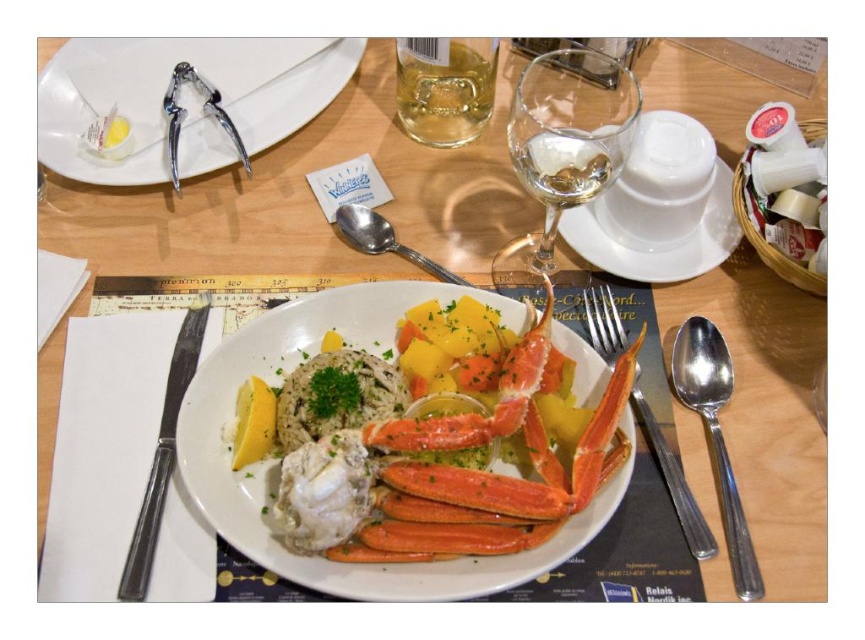
Question: Can you confirm if white glossy plate at center is smaller than metallic silver nutcracker at upper left?

Choices:
 (A) yes
 (B) no

Answer: (B)

Question: Which object is positioned farthest from the polished silver spoon at right?

Choices:
 (A) transparent glass wine glass at upper center
 (B) clear glass wine at upper center
 (C) translucent glass at upper center

Answer: (C)

Question: Observing the image, what is the correct spatial positioning of translucent glass at upper center in reference to satin silver fork at center right?

Choices:
 (A) left
 (B) right

Answer: (A)

Question: Which object is the farthest from the transparent glass wine glass at upper center?

Choices:
 (A) clear glass wine at upper center
 (B) polished silver spoon at right
 (C) translucent glass at upper center
 (D) white glossy plate at center

Answer: (B)

Question: Considering the real-world distances, which object is farthest from the satin silver fork at center right?

Choices:
 (A) transparent glass wine glass at upper center
 (B) polished silver spoon at right
 (C) white glossy plate at center
 (D) polished metal knife at left

Answer: (D)

Question: Is white glossy plate at center below white porcelain plate at upper center?

Choices:
 (A) no
 (B) yes

Answer: (B)